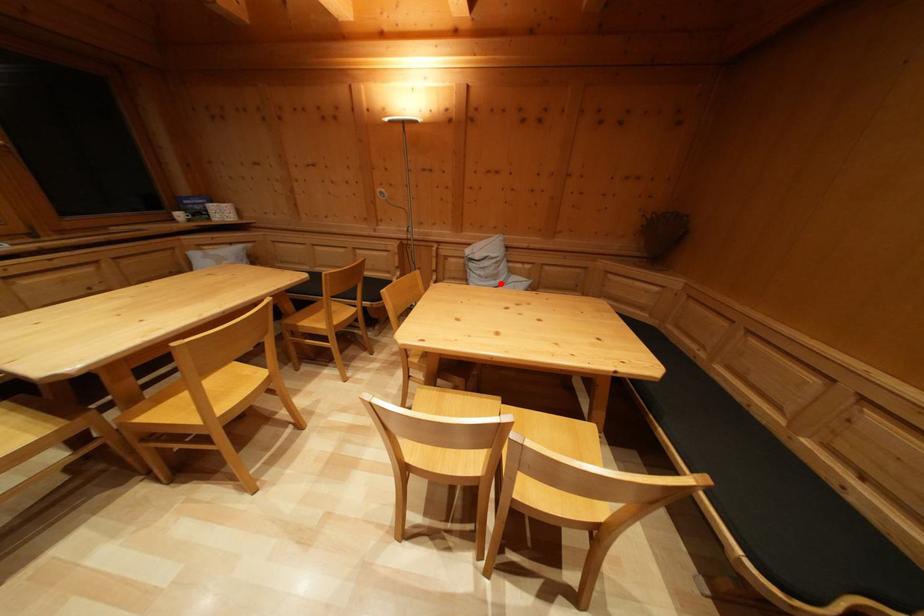
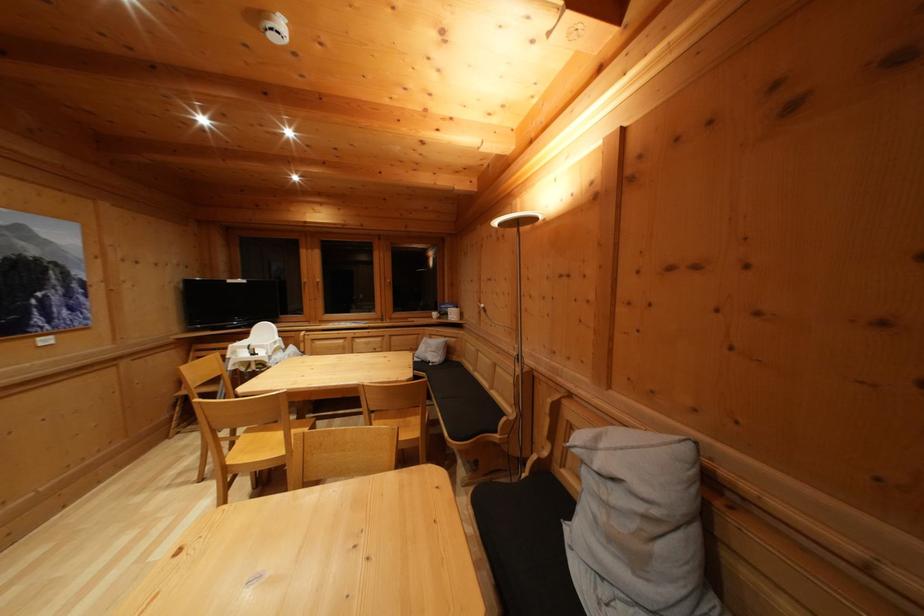
In the second image, find the point that corresponds to the highlighted location in the first image.

(640, 565)